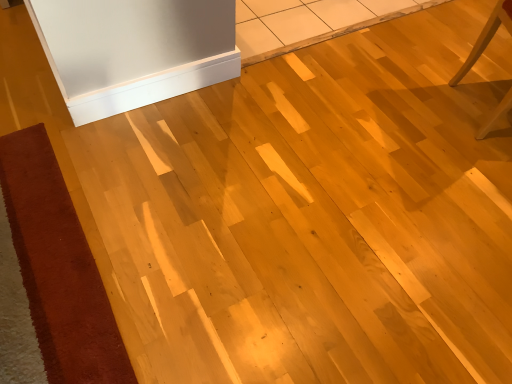
What do you see at coordinates (486, 37) in the screenshot? I see `light wood chair at right` at bounding box center [486, 37].

I want to click on velvet-like brown mat at lower left, so click(58, 267).

What's the angular difference between velvet-like brown mat at lower left and light wood chair at right's facing directions?

There is a 26.4-degree angle between the facing directions of velvet-like brown mat at lower left and light wood chair at right.

Is light wood chair at right located within velvet-like brown mat at lower left?

No, light wood chair at right is not surrounded by velvet-like brown mat at lower left.

Locate an element on the screen. doormat on the left of light wood chair at right is located at coordinates (58, 267).

Is light wood chair at right closer to camera compared to white glossy baseboard at upper center?

Yes, light wood chair at right is closer to the viewer.

Which is less distant, [497,24] or [63,67]?

Point [63,67]

Considering the relative positions of light wood chair at right and white glossy baseboard at upper center in the image provided, is light wood chair at right to the left of white glossy baseboard at upper center from the viewer's perspective?

No, light wood chair at right is not to the left of white glossy baseboard at upper center.

Is velvet-like brown mat at lower left touching white glossy baseboard at upper center?

velvet-like brown mat at lower left and white glossy baseboard at upper center are not in contact.

Looking at this image, is velvet-like brown mat at lower left smaller than white glossy baseboard at upper center?

No.

Which of these two, velvet-like brown mat at lower left or white glossy baseboard at upper center, stands shorter?

With less height is velvet-like brown mat at lower left.

From a real-world perspective, is velvet-like brown mat at lower left positioned under white glossy baseboard at upper center based on gravity?

Indeed, from a real-world perspective, velvet-like brown mat at lower left is positioned beneath white glossy baseboard at upper center.

From the image's perspective, does white glossy baseboard at upper center appear higher than light wood chair at right?

Incorrect, from the image's perspective, white glossy baseboard at upper center is lower than light wood chair at right.

Is white glossy baseboard at upper center shorter than light wood chair at right?

Correct, white glossy baseboard at upper center is not as tall as light wood chair at right.

Between white glossy baseboard at upper center and light wood chair at right, which one has larger width?

With larger width is light wood chair at right.

From a real-world perspective, is white glossy baseboard at upper center positioned under velvet-like brown mat at lower left based on gravity?

Actually, white glossy baseboard at upper center is physically above velvet-like brown mat at lower left in the real world.

From the image's perspective, between white glossy baseboard at upper center and velvet-like brown mat at lower left, who is located below?

velvet-like brown mat at lower left appears lower in the image.

Is white glossy baseboard at upper center shorter than velvet-like brown mat at lower left?

Incorrect, the height of white glossy baseboard at upper center does not fall short of that of velvet-like brown mat at lower left.

Is white glossy baseboard at upper center not inside velvet-like brown mat at lower left?

Yes, white glossy baseboard at upper center is not within velvet-like brown mat at lower left.

Between light wood chair at right and velvet-like brown mat at lower left, which one has more height?

Standing taller between the two is light wood chair at right.

Considering the points (469, 56) and (44, 226), which point is behind, point (469, 56) or point (44, 226)?

Positioned behind is point (469, 56).

There is a velvet-like brown mat at lower left. What are the coordinates of `furniture above it (from a real-world perspective)` in the screenshot? It's located at (486, 37).

Locate an element on the screen. The height and width of the screenshot is (384, 512). doormat in front of the light wood chair at right is located at coordinates (58, 267).

You are a GUI agent. You are given a task and a screenshot of the screen. Output one action in this format:
    pyautogui.click(x=<x>, y=<y>)
    Task: Click on the furniture above the white glossy baseboard at upper center (from a real-world perspective)
    
    Given the screenshot: What is the action you would take?
    pyautogui.click(x=486, y=37)

Estimate the real-world distances between objects in this image. Which object is closer to light wood chair at right, white glossy baseboard at upper center or velvet-like brown mat at lower left?

white glossy baseboard at upper center.

When comparing their distances from white glossy baseboard at upper center, does velvet-like brown mat at lower left or light wood chair at right seem closer?

Based on the image, velvet-like brown mat at lower left appears to be nearer to white glossy baseboard at upper center.

Which object lies nearer to the anchor point white glossy baseboard at upper center, light wood chair at right or velvet-like brown mat at lower left?

Based on the image, velvet-like brown mat at lower left appears to be nearer to white glossy baseboard at upper center.

Which object lies further to the anchor point light wood chair at right, velvet-like brown mat at lower left or white glossy baseboard at upper center?

Among the two, velvet-like brown mat at lower left is located further to light wood chair at right.

Looking at the image, which one is located further to velvet-like brown mat at lower left, light wood chair at right or white glossy baseboard at upper center?

Based on the image, light wood chair at right appears to be further to velvet-like brown mat at lower left.

Looking at the image, which one is located further to velvet-like brown mat at lower left, white glossy baseboard at upper center or light wood chair at right?

light wood chair at right is positioned further to the anchor velvet-like brown mat at lower left.

Find the location of a particular element. This screenshot has height=384, width=512. fridge between velvet-like brown mat at lower left and light wood chair at right in the horizontal direction is located at coordinates (134, 50).